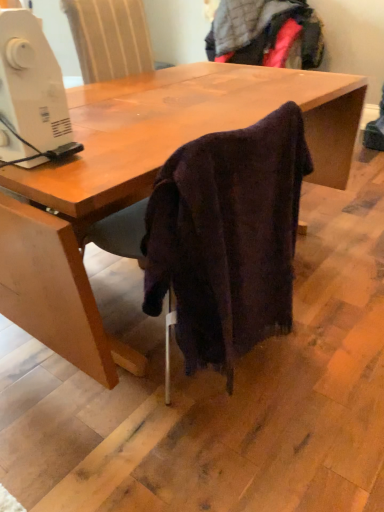
Locate an element on the screen. This screenshot has width=384, height=512. white plastic sewing machine at left is located at coordinates (31, 95).

This screenshot has width=384, height=512. Describe the element at coordinates (31, 95) in the screenshot. I see `white plastic sewing machine at left` at that location.

This screenshot has height=512, width=384. Describe the element at coordinates (221, 237) in the screenshot. I see `dark woolen sweater at lower center` at that location.

Find the location of `dark woolen sweater at lower center`. dark woolen sweater at lower center is located at coordinates (221, 237).

In the scene shown: Measure the distance between point (268, 254) and camera.

The depth of point (268, 254) is 1.20 meters.

Image resolution: width=384 pixels, height=512 pixels. What are the coordinates of `white plastic sewing machine at left` in the screenshot? It's located at [x=31, y=95].

Does white plastic sewing machine at left appear on the right side of dark woolen sweater at lower center?

Incorrect, white plastic sewing machine at left is not on the right side of dark woolen sweater at lower center.

In the image, is white plastic sewing machine at left positioned in front of or behind dark woolen sweater at lower center?

white plastic sewing machine at left is positioned closer to the viewer than dark woolen sweater at lower center.

Does point (44, 104) appear closer or farther from the camera than point (146, 254)?

Point (44, 104) is closer to the camera than point (146, 254).

From the image's perspective, who appears lower, white plastic sewing machine at left or dark woolen sweater at lower center?

dark woolen sweater at lower center, from the image's perspective.

From a real-world perspective, between white plastic sewing machine at left and dark woolen sweater at lower center, who is vertically lower?

dark woolen sweater at lower center is physically lower.

Which object is wider, white plastic sewing machine at left or dark woolen sweater at lower center?

Wider between the two is dark woolen sweater at lower center.

Which of these two, white plastic sewing machine at left or dark woolen sweater at lower center, stands shorter?

white plastic sewing machine at left is shorter.

Can you confirm if white plastic sewing machine at left is smaller than dark woolen sweater at lower center?

Yes.

Which is correct: white plastic sewing machine at left is inside dark woolen sweater at lower center, or outside of it?

The correct answer is: outside.

Is white plastic sewing machine at left positioned far away from dark woolen sweater at lower center?

white plastic sewing machine at left is actually quite close to dark woolen sweater at lower center.

Is white plastic sewing machine at left facing away from dark woolen sweater at lower center?

No, white plastic sewing machine at left's orientation is not away from dark woolen sweater at lower center.

How different are the orientations of white plastic sewing machine at left and dark woolen sweater at lower center in degrees?

There is a 85.4-degree angle between the facing directions of white plastic sewing machine at left and dark woolen sweater at lower center.

Find the location of `chair directly beneath the white plastic sewing machine at left (from a real-world perspective)`. chair directly beneath the white plastic sewing machine at left (from a real-world perspective) is located at coordinates (221, 237).

Considering the positions of objects dark woolen sweater at lower center and white plastic sewing machine at left in the image provided, who is more to the right, dark woolen sweater at lower center or white plastic sewing machine at left?

dark woolen sweater at lower center.

Which is behind, dark woolen sweater at lower center or white plastic sewing machine at left?

dark woolen sweater at lower center is more distant.

Is point (169, 208) more distant than point (44, 122)?

No, it is not.

From the image's perspective, between dark woolen sweater at lower center and white plastic sewing machine at left, who is located below?

dark woolen sweater at lower center.

From a real-world perspective, which object stands above the other?

In real-world perspective, white plastic sewing machine at left is above.

Does dark woolen sweater at lower center have a greater width compared to white plastic sewing machine at left?

Indeed, dark woolen sweater at lower center has a greater width compared to white plastic sewing machine at left.

Which of these two, dark woolen sweater at lower center or white plastic sewing machine at left, stands taller?

Answer: Standing taller between the two is dark woolen sweater at lower center.

Considering the sizes of dark woolen sweater at lower center and white plastic sewing machine at left in the image, is dark woolen sweater at lower center bigger or smaller than white plastic sewing machine at left?

Considering their sizes, dark woolen sweater at lower center takes up more space than white plastic sewing machine at left.

Is dark woolen sweater at lower center situated inside white plastic sewing machine at left or outside?

dark woolen sweater at lower center is spatially situated outside white plastic sewing machine at left.

Is dark woolen sweater at lower center in contact with white plastic sewing machine at left?

No, dark woolen sweater at lower center is not with white plastic sewing machine at left.

Could you tell me if dark woolen sweater at lower center is turned towards white plastic sewing machine at left?

No, dark woolen sweater at lower center is not oriented towards white plastic sewing machine at left.

How different are the orientations of dark woolen sweater at lower center and white plastic sewing machine at left in degrees?

The facing directions of dark woolen sweater at lower center and white plastic sewing machine at left are 85.4 degrees apart.

Find the location of `sewing machine that is on the left side of dark woolen sweater at lower center`. sewing machine that is on the left side of dark woolen sweater at lower center is located at coordinates tap(31, 95).

The width and height of the screenshot is (384, 512). Find the location of `chair below the white plastic sewing machine at left (from a real-world perspective)`. chair below the white plastic sewing machine at left (from a real-world perspective) is located at coordinates (221, 237).

Where is `chair below the white plastic sewing machine at left (from the image's perspective)`? The image size is (384, 512). chair below the white plastic sewing machine at left (from the image's perspective) is located at coordinates (221, 237).